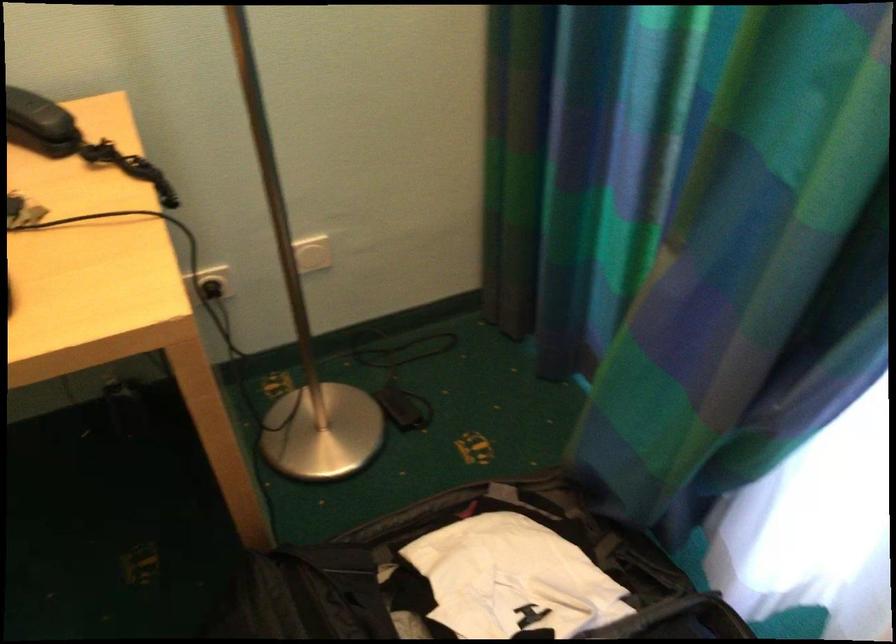
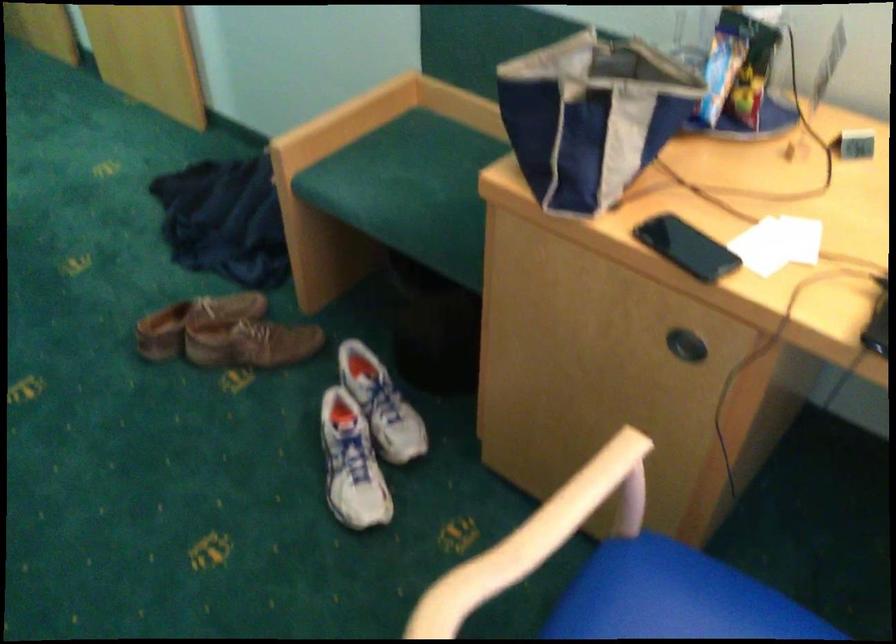
The first image is from the beginning of the video and the second image is from the end. How did the camera likely rotate when shooting the video?

The camera rotated toward left-down.